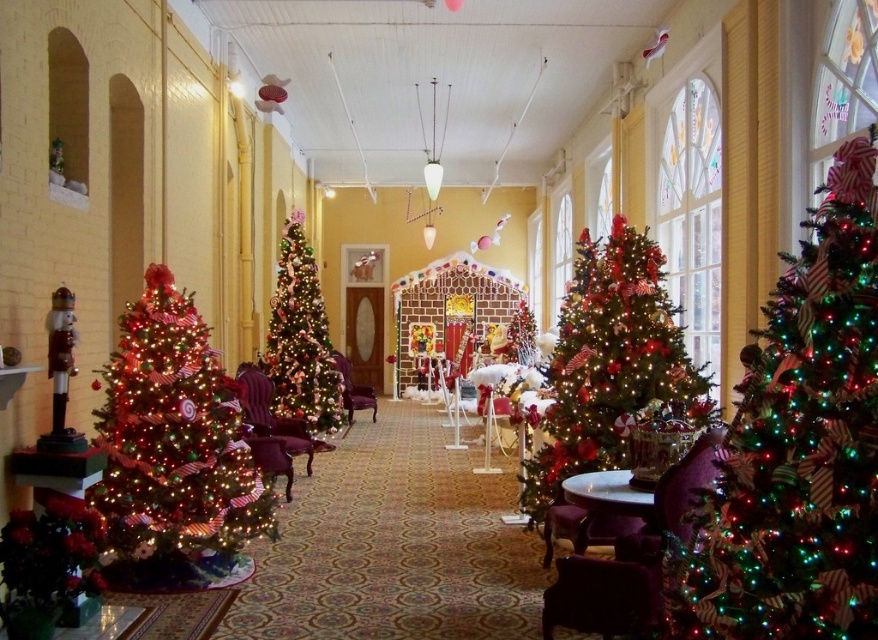
You are standing at the entrance of the hallway and want to place a small gift box on the velvet burgundy armchair at center. However, there is a shiny green christmas tree at right in the way. Can you place the gift box on the armchair without moving the tree?

The shiny green christmas tree at right is above the velvet burgundy armchair at center, so you can place the gift box on the armchair without moving the tree since the tree is positioned above it and does not block access.

You are standing at the entrance of the hallway and want to reach a gift placed at one of the two points. The gift is either at point (846, 568) or point (553, 464). Which point is closer to you?

Point (846, 568) is closer to the viewer than point (553, 464), so the gift at point (846, 568) is closer to you.